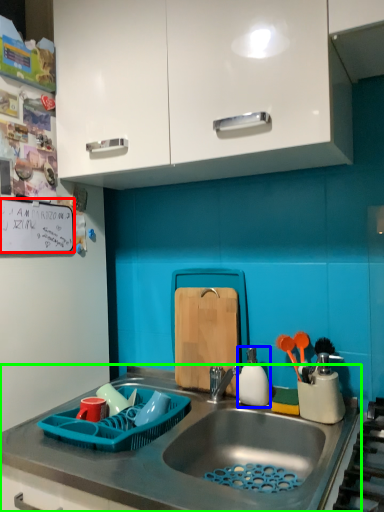
Question: Estimate the real-world distances between objects in this image. Which object is farther from bulletin board (highlighted by a red box), appliance (highlighted by a blue box) or countertop (highlighted by a green box)?

Choices:
 (A) appliance
 (B) countertop

Answer: (A)